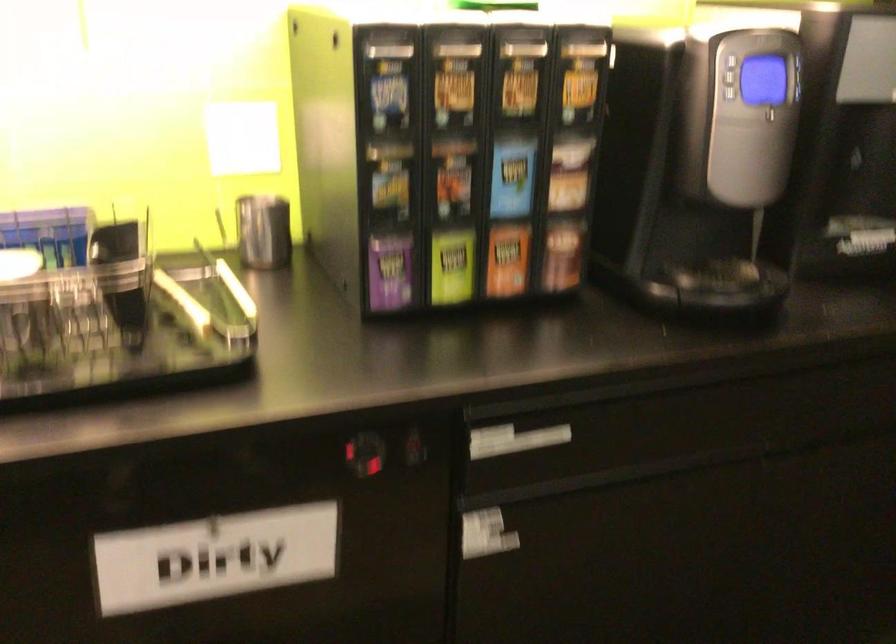
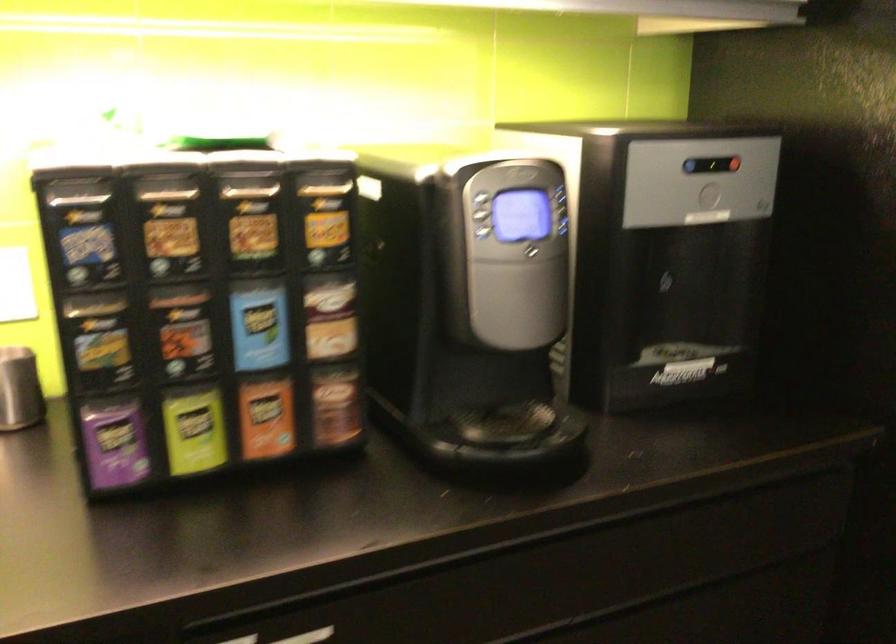
Locate, in the second image, the point that corresponds to (451,263) in the first image.

(194, 430)